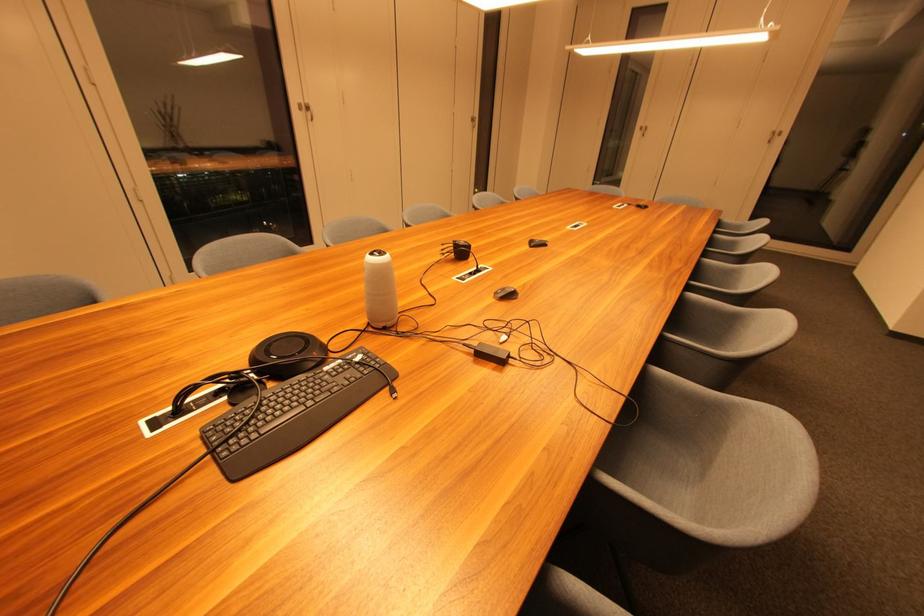
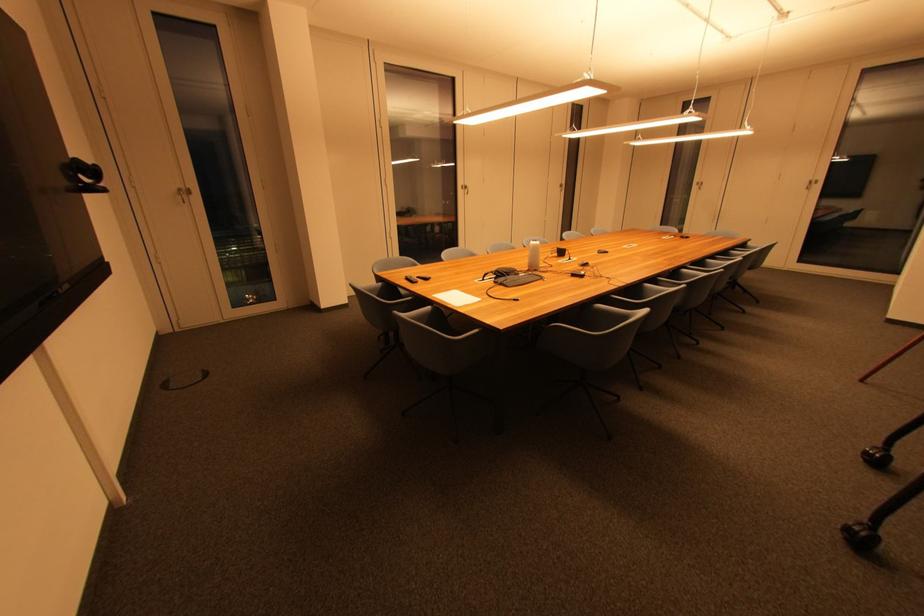
The point at [487,358] is marked in the first image. Where is the corresponding point in the second image?

(578, 277)